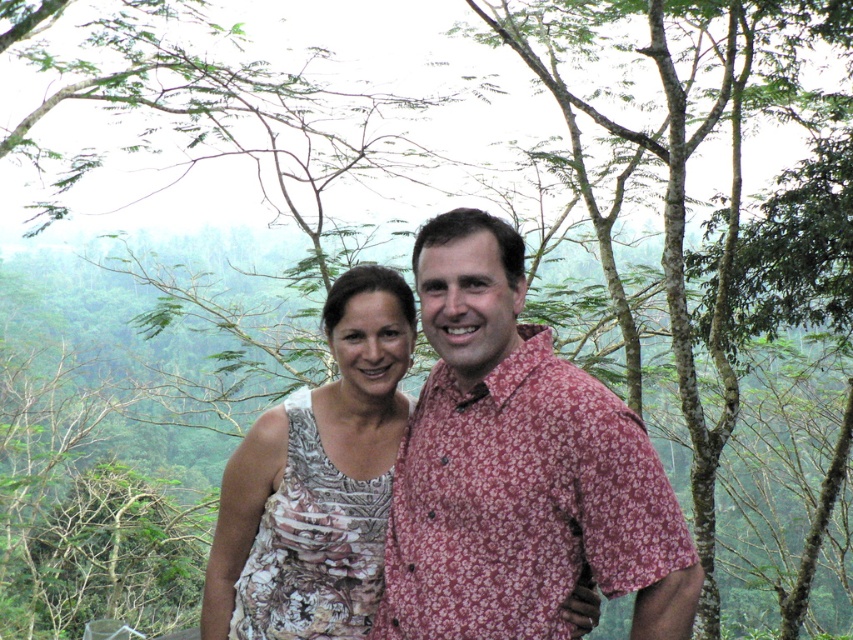
Measure the distance between floral-patterned shirt at center and camera.

2.95 meters

Who is positioned more to the right, floral-patterned shirt at center or white floral dress at center?

From the viewer's perspective, floral-patterned shirt at center appears more on the right side.

Find the location of a particular element. Image resolution: width=853 pixels, height=640 pixels. floral-patterned shirt at center is located at coordinates point(518,468).